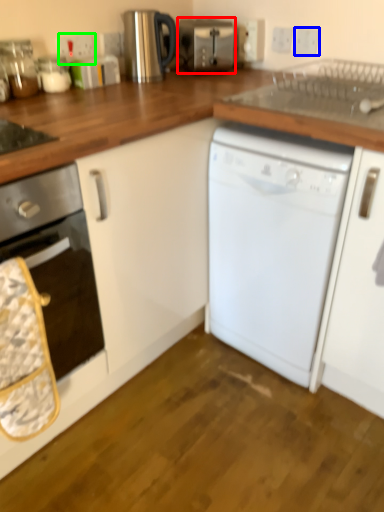
Question: Based on their relative distances, which object is farther from toaster (highlighted by a red box)? Choose from electric outlet (highlighted by a blue box) and electric outlet (highlighted by a green box).

Choices:
 (A) electric outlet
 (B) electric outlet

Answer: (B)